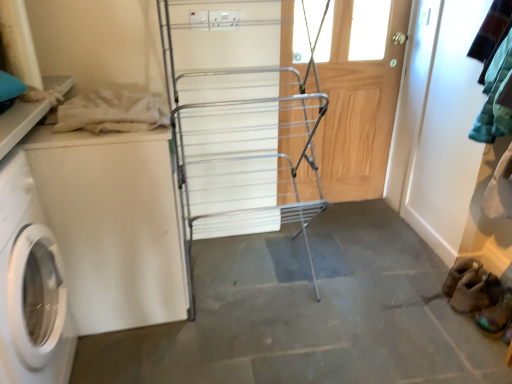
Locate an element on the screen. This screenshot has height=384, width=512. vacant area that is in front of brown suede shoe at lower right, arranged as the first shoe when viewed from the back is located at coordinates (479, 346).